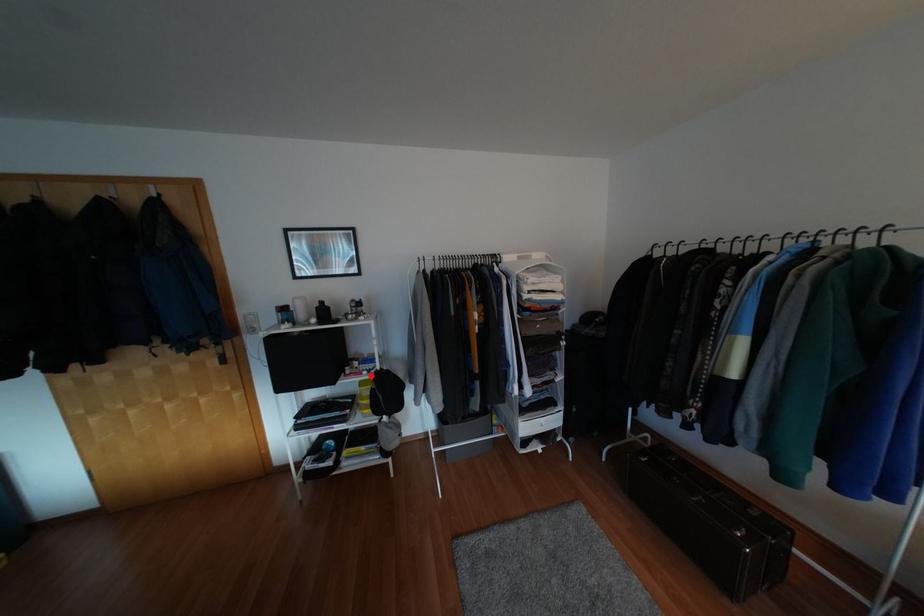
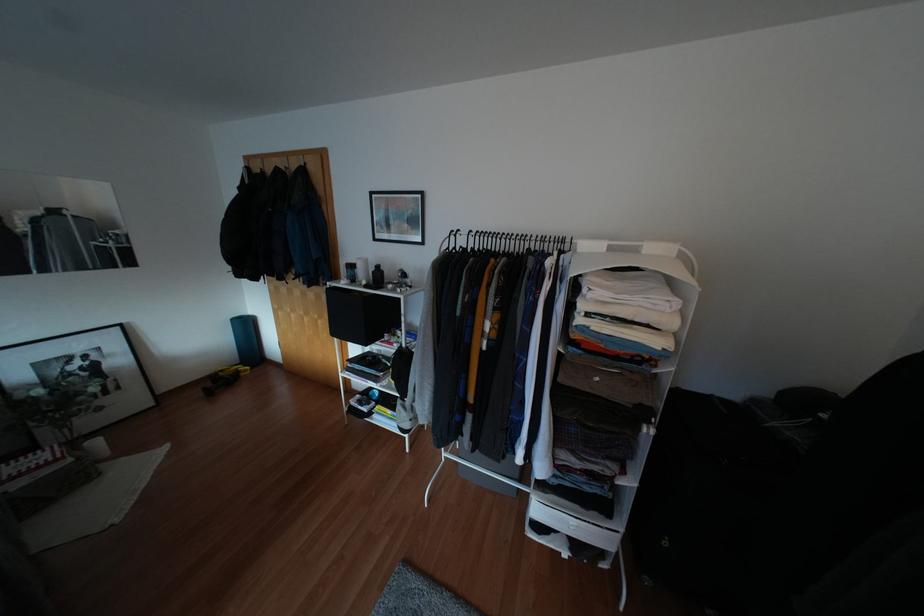
Find the pixel in the second image that matches the highlighted location in the first image.

(394, 351)